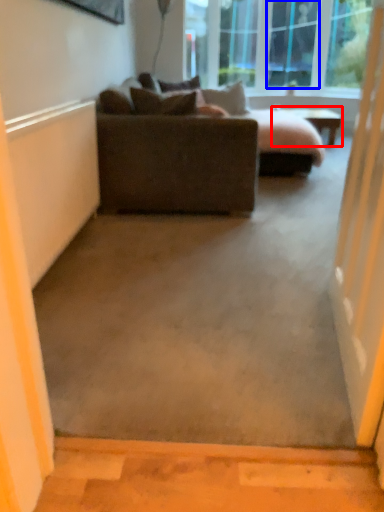
Question: Which object appears farthest to the camera in this image, table (highlighted by a red box) or glass door (highlighted by a blue box)?

Choices:
 (A) table
 (B) glass door

Answer: (B)